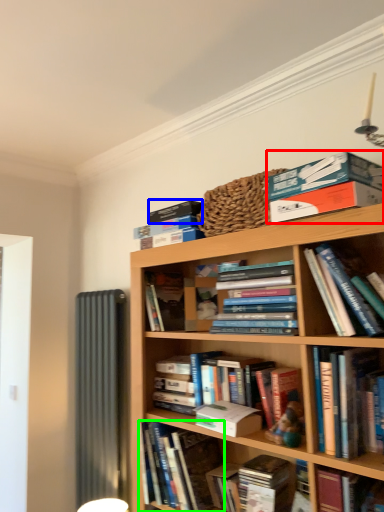
Question: Considering the real-world distances, which object is closest to book (highlighted by a red box)? paperback book (highlighted by a blue box) or book (highlighted by a green box).

Choices:
 (A) paperback book
 (B) book

Answer: (A)